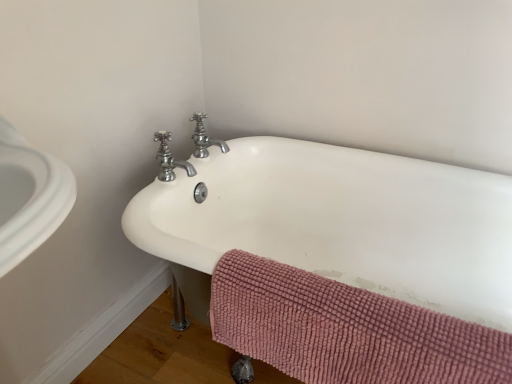
Question: Considering the relative sizes of polished chrome faucet at upper center, arranged as the second tap when viewed from the back, and pink chenille bath towel at lower right in the image provided, is polished chrome faucet at upper center, arranged as the second tap when viewed from the back, taller than pink chenille bath towel at lower right?

Choices:
 (A) no
 (B) yes

Answer: (A)

Question: Is polished chrome faucet at upper center, which ranks as the 1th tap in front-to-back order, positioned with its back to pink chenille bath towel at lower right?

Choices:
 (A) no
 (B) yes

Answer: (A)

Question: Considering the relative sizes of polished chrome faucet at upper center, arranged as the second tap when viewed from the back, and pink chenille bath towel at lower right in the image provided, is polished chrome faucet at upper center, arranged as the second tap when viewed from the back, smaller than pink chenille bath towel at lower right?

Choices:
 (A) no
 (B) yes

Answer: (B)

Question: Is polished chrome faucet at upper center, which ranks as the 1th tap in front-to-back order, behind pink chenille bath towel at lower right?

Choices:
 (A) no
 (B) yes

Answer: (B)

Question: From a real-world perspective, is polished chrome faucet at upper center, which ranks as the 1th tap in front-to-back order, on top of pink chenille bath towel at lower right?

Choices:
 (A) yes
 (B) no

Answer: (A)

Question: Is polished chrome faucet at upper center, which ranks as the 1th tap in front-to-back order, directly adjacent to pink chenille bath towel at lower right?

Choices:
 (A) no
 (B) yes

Answer: (A)

Question: Does polished chrome faucet at upper center, which ranks as the 1th tap in front-to-back order, have a larger size compared to white ceramic bathtub at center?

Choices:
 (A) no
 (B) yes

Answer: (A)

Question: Does polished chrome faucet at upper center, arranged as the second tap when viewed from the back, appear on the left side of white ceramic bathtub at center?

Choices:
 (A) yes
 (B) no

Answer: (A)

Question: From a real-world perspective, is polished chrome faucet at upper center, arranged as the second tap when viewed from the back, positioned under white ceramic bathtub at center based on gravity?

Choices:
 (A) no
 (B) yes

Answer: (A)

Question: Does polished chrome faucet at upper center, arranged as the second tap when viewed from the back, lie in front of white ceramic bathtub at center?

Choices:
 (A) yes
 (B) no

Answer: (B)

Question: Is polished chrome faucet at upper center, arranged as the second tap when viewed from the back, with white ceramic bathtub at center?

Choices:
 (A) yes
 (B) no

Answer: (B)

Question: From a real-world perspective, is polished chrome faucet at upper center, which ranks as the 1th tap in front-to-back order, over white ceramic bathtub at center?

Choices:
 (A) no
 (B) yes

Answer: (B)

Question: Is polished chrome faucet at upper center, which appears as the 1th tap when viewed from the back, far away from polished chrome faucet at upper center, which ranks as the 1th tap in front-to-back order?

Choices:
 (A) yes
 (B) no

Answer: (B)